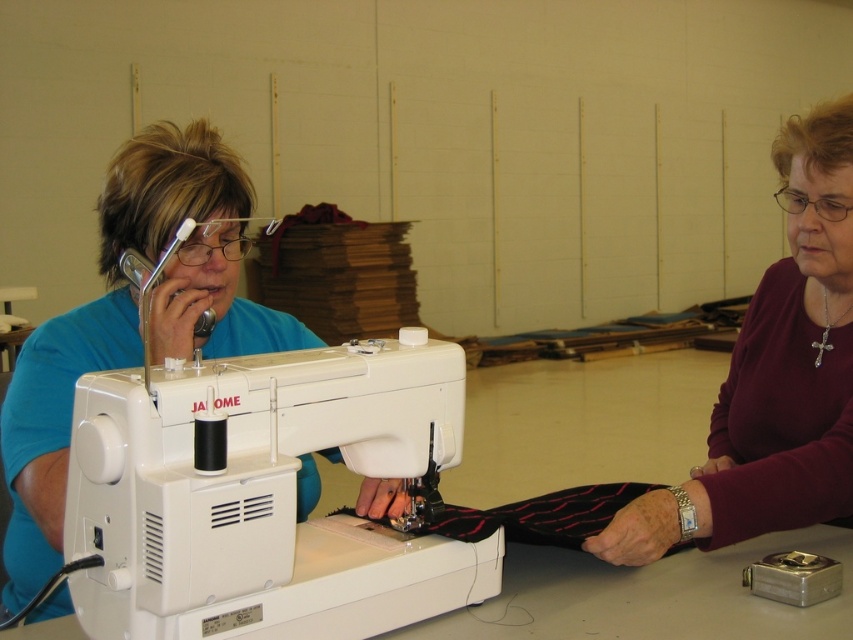
Who is more forward, (419, 563) or (194, 179)?

Positioned in front is point (419, 563).

Is white plastic sewing machine at center smaller than blue fabric at left?

Indeed, white plastic sewing machine at center has a smaller size compared to blue fabric at left.

Who is more forward, (74, 433) or (62, 500)?

Positioned in front is point (74, 433).

At what (x,y) coordinates should I click in order to perform the action: click on white plastic sewing machine at center. Please return your answer as a coordinate pair (x, y). This screenshot has height=640, width=853. Looking at the image, I should click on point(264,497).